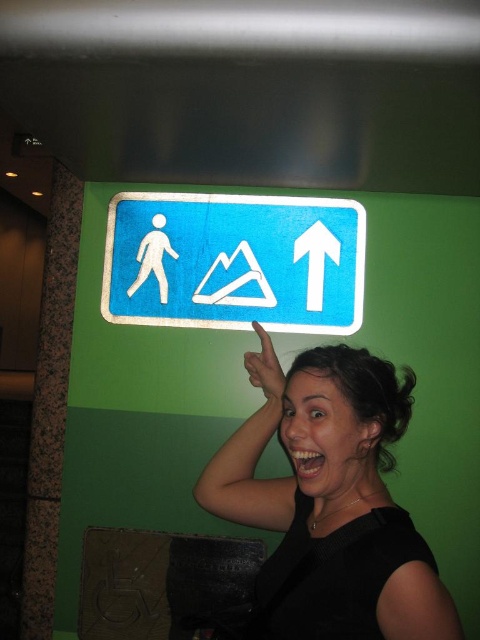
You are a tour guide explaining the symbols on the sign to a visitor. The visitor asks which of the two objects, the black matte hair at upper right or the white glossy arrow at upper center, is bigger. What do you tell them?

The black matte hair at upper right is larger in size than the white glossy arrow at upper center.

You are standing in a room with a woman pointing upwards. She is pointing at a sign with three icons. The icons include a walking figure, a mountain range, and an upward arrow. You notice a point marked at coordinates (315, 259). According to the description, where is this point located?

The point marked at coordinates (315, 259) is located on the white glossy arrow at upper center of the sign.